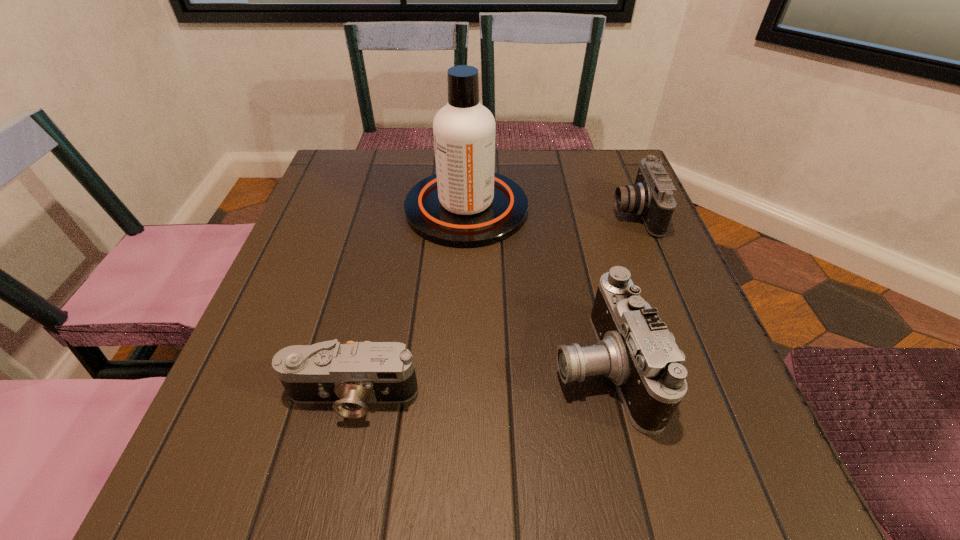
Identify the location of vacant space at the left edge. (300, 260).

Where is `vacant space at the right edge of the desktop`? vacant space at the right edge of the desktop is located at coordinates (634, 231).

At what (x,y) coordinates should I click in order to perform the action: click on vacant area at the far left corner. Please return your answer as a coordinate pair (x, y). Looking at the image, I should click on (343, 174).

The height and width of the screenshot is (540, 960). I want to click on vacant region at the far right corner of the desktop, so click(x=567, y=153).

Image resolution: width=960 pixels, height=540 pixels. Identify the location of vacant area at the near right corner of the desktop. (685, 489).

Where is `vacant area that lies between the cleansing agent and the rightmost camera`? vacant area that lies between the cleansing agent and the rightmost camera is located at coordinates (550, 211).

This screenshot has width=960, height=540. I want to click on free space that is in between the tallest object and the second camera from left to right, so click(534, 287).

Locate an element on the screen. vacant space in between the leftmost camera and the cleansing agent is located at coordinates (409, 302).

You are a GUI agent. You are given a task and a screenshot of the screen. Output one action in this format:
    pyautogui.click(x=<x>, y=<y>)
    Task: Click on the free space that is in between the shortest camera and the cleansing agent
    This screenshot has height=540, width=960.
    Given the screenshot: What is the action you would take?
    pyautogui.click(x=409, y=302)

Locate an element on the screen. free point between the shortest object and the second camera from right to left is located at coordinates (476, 381).